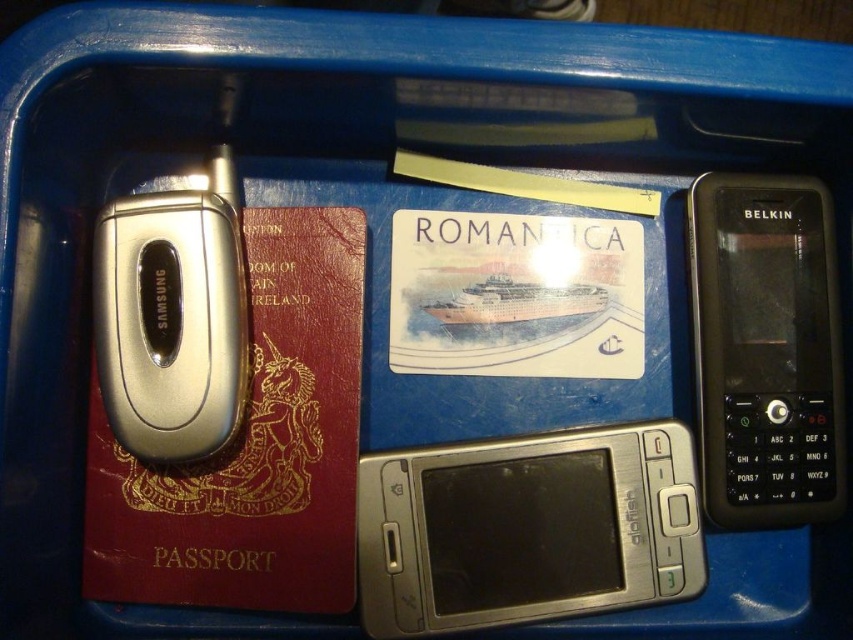
You are organizing items in a blue plastic storage bin. You have a silver metallic smartphone at center and a black plastic phone at right. Which item is wider?

The silver metallic smartphone at center is wider than the black plastic phone at right.

You are organizing items in a storage bin. You have a black plastic phone at right and a silver metallic samsung phone at left. Which one is wider?

The black plastic phone at right is wider than the silver metallic samsung phone at left.

You are organizing items in a blue plastic storage bin. You have a black plastic phone at right and a silver metallic samsung phone at left. Which phone is taller?

The black plastic phone at right is taller than the silver metallic samsung phone at left.